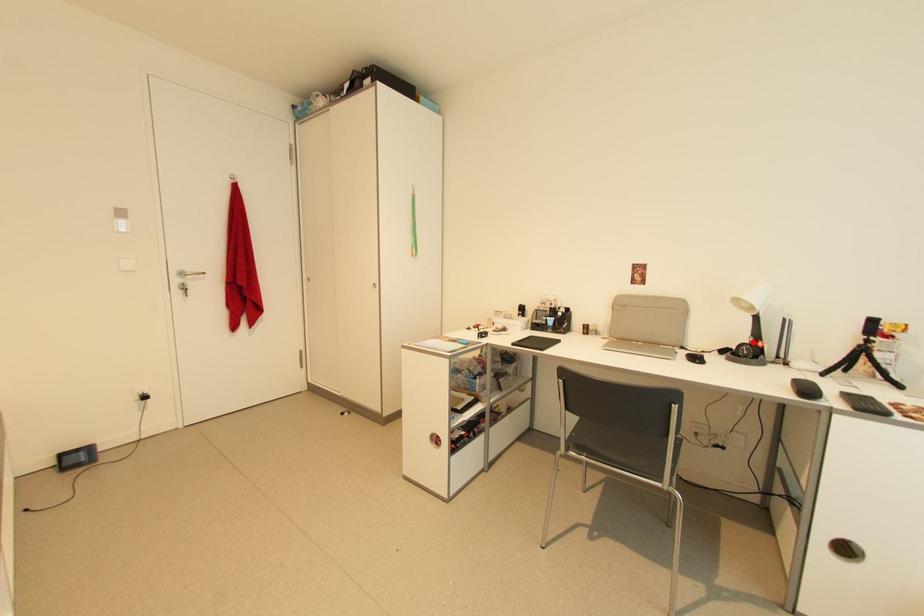
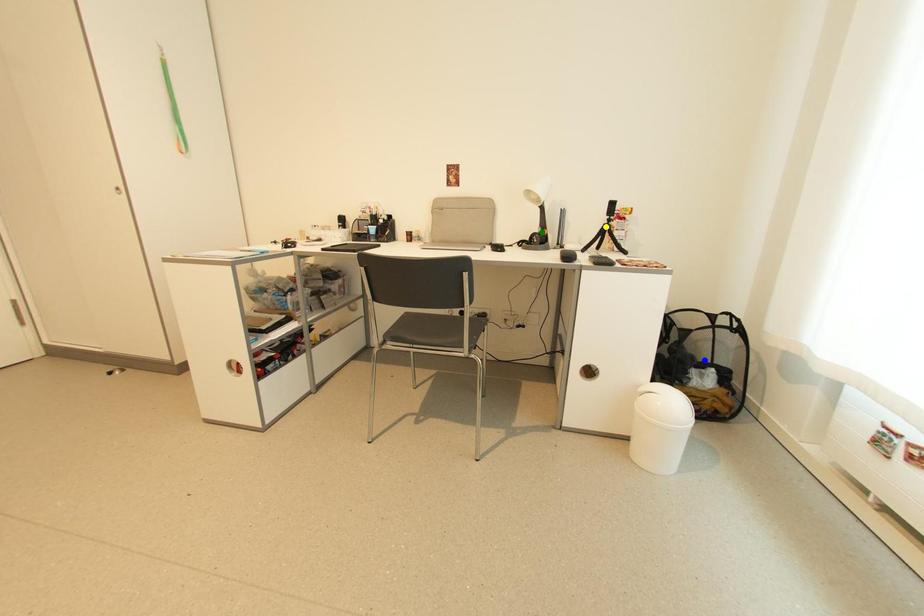
Question: I am providing you with two images of the same scene from different viewpoints. A red point is marked on the first image. You are given multiple points on the second image. Which mark in image 2 goes with the point in image 1?

Choices:
 (A) yellow point
 (B) blue point
 (C) green point

Answer: (C)